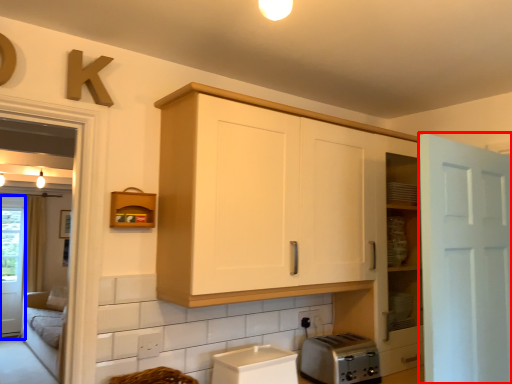
Question: Which object is further to the camera taking this photo, door (highlighted by a red box) or screen door (highlighted by a blue box)?

Choices:
 (A) door
 (B) screen door

Answer: (B)